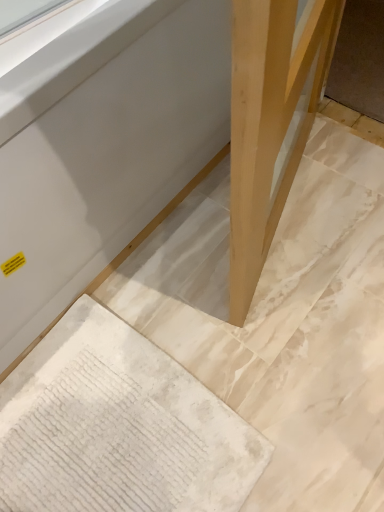
What is the approximate height of white textured rug at lower left?

2.13 inches.

At what (x,y) coordinates should I click in order to perform the action: click on natural wood leg at center. Please return your answer as a coordinate pair (x, y). This screenshot has width=384, height=512. Looking at the image, I should click on (271, 121).

The width and height of the screenshot is (384, 512). What do you see at coordinates (271, 121) in the screenshot? I see `natural wood leg at center` at bounding box center [271, 121].

At what (x,y) coordinates should I click in order to perform the action: click on matte wood table at center. Please return your answer as a coordinate pair (x, y). The height and width of the screenshot is (512, 384). Looking at the image, I should click on (271, 120).

Considering the sizes of white textured rug at lower left and natural wood leg at center in the image, is white textured rug at lower left taller or shorter than natural wood leg at center?

Considering their sizes, white textured rug at lower left has less height than natural wood leg at center.

From a real-world perspective, is white textured rug at lower left under natural wood leg at center?

Indeed, from a real-world perspective, white textured rug at lower left is positioned beneath natural wood leg at center.

Does white textured rug at lower left have a larger size compared to natural wood leg at center?

No.

Which object is more forward, white textured rug at lower left or natural wood leg at center?

natural wood leg at center.

From a real-world perspective, which is physically above, white textured rug at lower left or matte wood table at center?

From a 3D spatial view, matte wood table at center is above.

Where is `furniture in front of the white textured rug at lower left`? furniture in front of the white textured rug at lower left is located at coordinates (271, 120).

From the image's perspective, which one is positioned higher, white textured rug at lower left or matte wood table at center?

From the image's view, matte wood table at center is above.

In terms of height, does white textured rug at lower left look taller or shorter compared to matte wood table at center?

white textured rug at lower left is shorter than matte wood table at center.

Would you say natural wood leg at center is to the left or to the right of white textured rug at lower left in the picture?

From the image, it's evident that natural wood leg at center is to the right of white textured rug at lower left.

This screenshot has width=384, height=512. I want to click on writing that appears below the natural wood leg at center (from a real-world perspective), so point(97,447).

Is natural wood leg at center placed right next to white textured rug at lower left?

No, natural wood leg at center is not next to white textured rug at lower left.

Is natural wood leg at center positioned far away from matte wood table at center?

natural wood leg at center is near matte wood table at center, not far away.

From the image's perspective, is natural wood leg at center above or below matte wood table at center?

natural wood leg at center is below matte wood table at center.

Which is closer to the camera, (288, 180) or (264, 255)?

Point (288, 180).

Considering the sizes of matte wood table at center and natural wood leg at center in the image, is matte wood table at center taller or shorter than natural wood leg at center?

matte wood table at center is taller than natural wood leg at center.

Would you say matte wood table at center is to the left or to the right of natural wood leg at center in the picture?

Clearly, matte wood table at center is on the left of natural wood leg at center in the image.

From a real-world perspective, relative to natural wood leg at center, is matte wood table at center vertically above or below?

matte wood table at center is situated higher than natural wood leg at center in the real world.

Which is closer to the camera, (283, 97) or (113, 454)?

Point (283, 97) appears to be closer to the viewer than point (113, 454).

Between matte wood table at center and white textured rug at lower left, which one is positioned in front?

Positioned in front is matte wood table at center.

Between matte wood table at center and white textured rug at lower left, which one has less height?

Standing shorter between the two is white textured rug at lower left.

Could you tell me if matte wood table at center is turned towards white textured rug at lower left?

Yes, matte wood table at center is aimed at white textured rug at lower left.

Locate an element on the screen. The height and width of the screenshot is (512, 384). writing below the natural wood leg at center (from a real-world perspective) is located at coordinates pos(97,447).

Where is `writing behind the matte wood table at center`? The width and height of the screenshot is (384, 512). writing behind the matte wood table at center is located at coordinates (97, 447).

Based on their spatial positions, is natural wood leg at center or white textured rug at lower left closer to matte wood table at center?

natural wood leg at center.

When comparing their distances from white textured rug at lower left, does natural wood leg at center or matte wood table at center seem further?

natural wood leg at center is further to white textured rug at lower left.

Consider the image. Which object lies nearer to the anchor point white textured rug at lower left, matte wood table at center or natural wood leg at center?

matte wood table at center is positioned closer to the anchor white textured rug at lower left.

Estimate the real-world distances between objects in this image. Which object is closer to matte wood table at center, white textured rug at lower left or natural wood leg at center?

natural wood leg at center is positioned closer to the anchor matte wood table at center.

Based on the photo, estimate the real-world distances between objects in this image. Which object is closer to natural wood leg at center, matte wood table at center or white textured rug at lower left?

Based on the image, matte wood table at center appears to be nearer to natural wood leg at center.

Considering their positions, is white textured rug at lower left positioned further to natural wood leg at center than matte wood table at center?

Based on the image, white textured rug at lower left appears to be further to natural wood leg at center.

In order to click on wood between matte wood table at center and white textured rug at lower left in the vertical direction in this screenshot , I will do `click(271, 121)`.